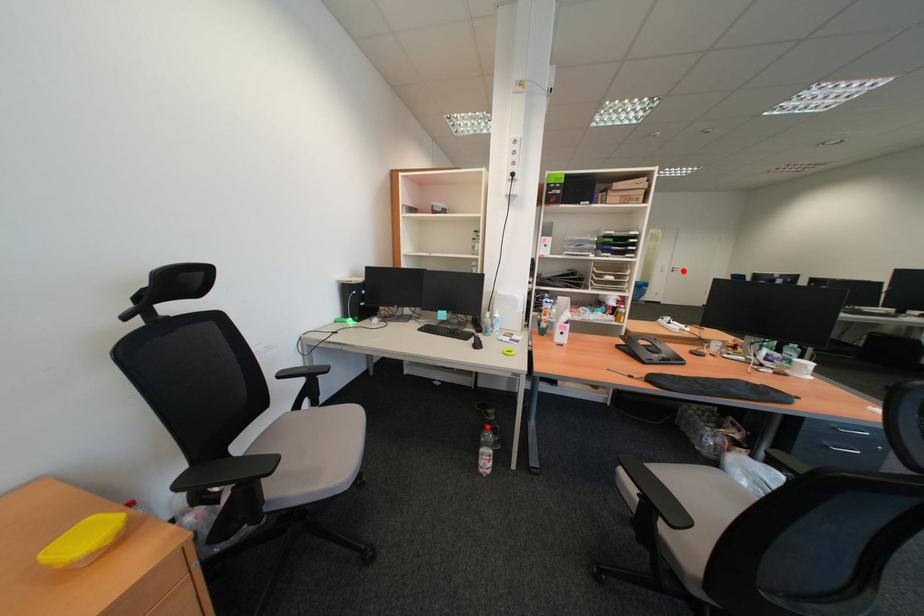
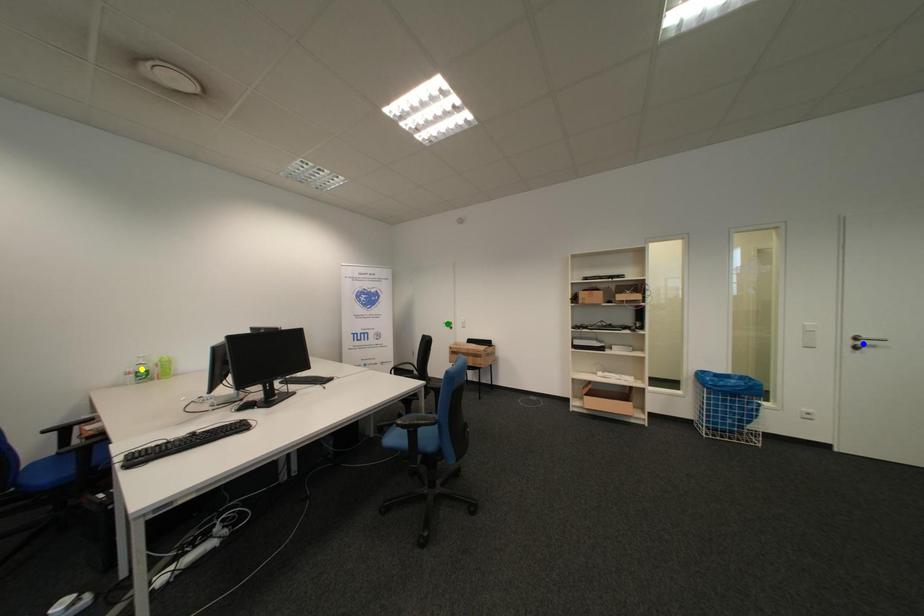
Question: I am providing you with two images of the same scene from different viewpoints. A red point is marked on the first image. You are given multiple points on the second image. In image 2, which mark is for the same physical point as the one in image 1?

Choices:
 (A) blue point
 (B) green point
 (C) yellow point

Answer: (A)